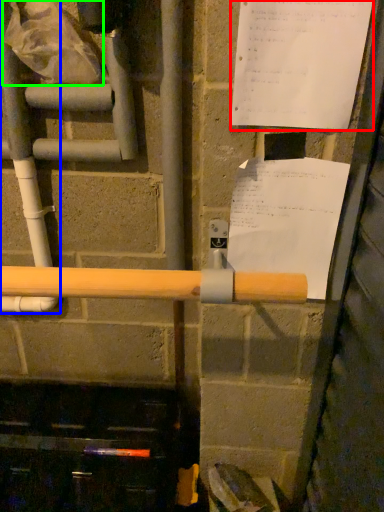
Question: Estimate the real-world distances between objects in this image. Which object is closer to paper (highlighted by a red box), water pipe (highlighted by a blue box) or plastic bag (highlighted by a green box)?

Choices:
 (A) water pipe
 (B) plastic bag

Answer: (B)